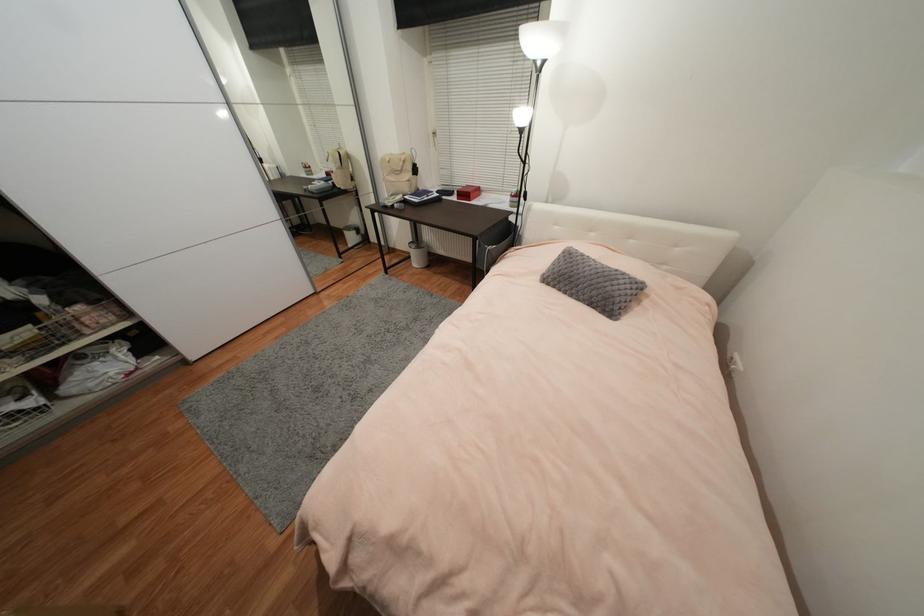
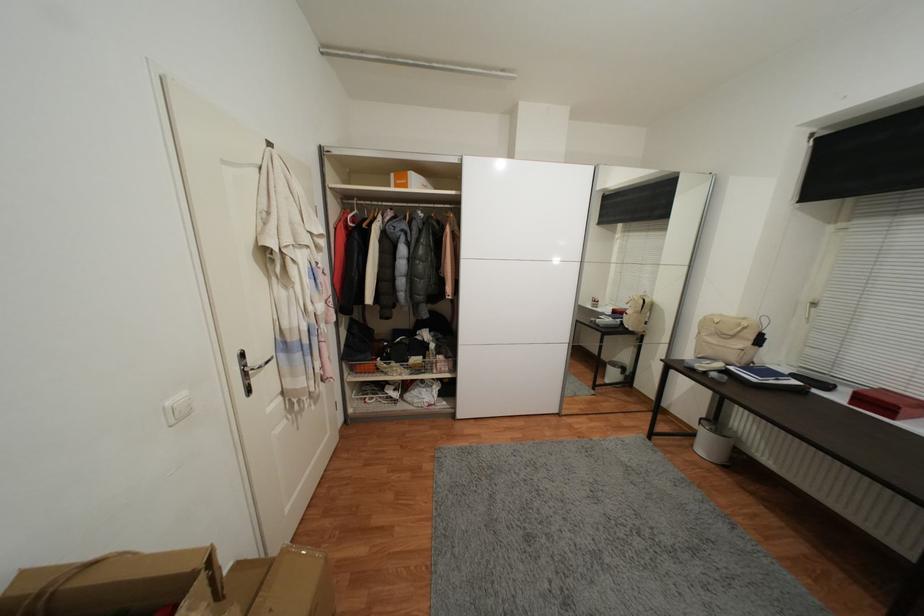
In the second image, find the point that corresponds to point (456, 195) in the first image.

(831, 387)